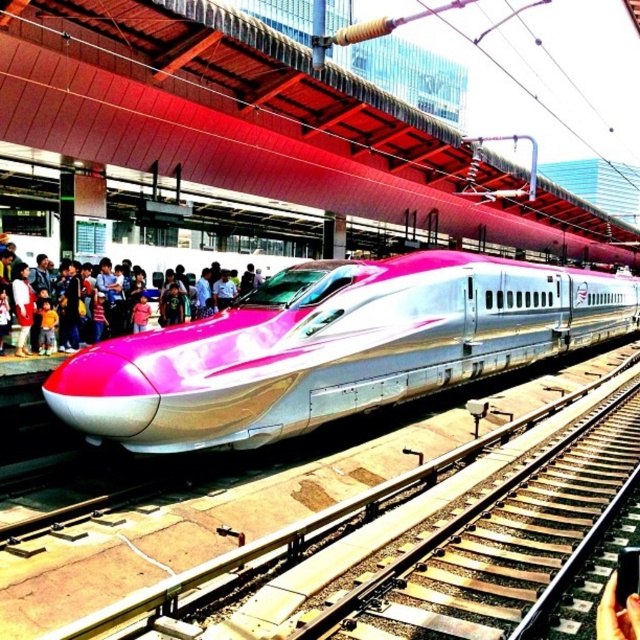
Question: Is pink metallic train at center further to camera compared to pink glossy train at center?

Choices:
 (A) yes
 (B) no

Answer: (B)

Question: Among these objects, which one is nearest to the camera?

Choices:
 (A) pink glossy train at center
 (B) pink metallic train at center

Answer: (B)

Question: Does pink metallic train at center appear on the left side of pink glossy train at center?

Choices:
 (A) no
 (B) yes

Answer: (A)

Question: Does pink metallic train at center appear under pink glossy train at center?

Choices:
 (A) yes
 (B) no

Answer: (A)

Question: Which object is farther from the camera taking this photo?

Choices:
 (A) pink glossy train at center
 (B) pink metallic train at center

Answer: (A)

Question: Which object is farther from the camera taking this photo?

Choices:
 (A) pink glossy train at center
 (B) pink metallic train at center

Answer: (A)